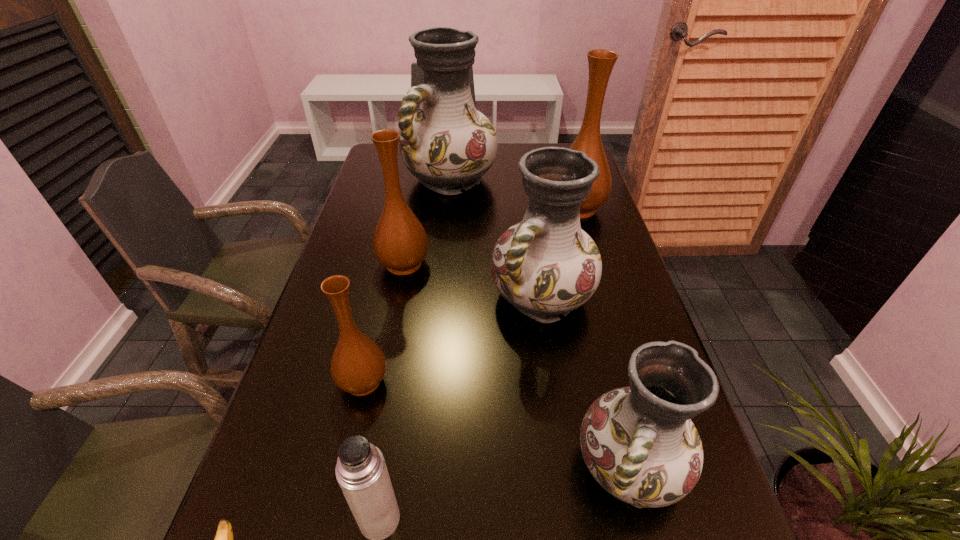
The width and height of the screenshot is (960, 540). I want to click on the farthest red vase, so click(x=447, y=144).

In order to click on the rightmost brown vase in this screenshot , I will do `click(600, 62)`.

Image resolution: width=960 pixels, height=540 pixels. Find the location of `the farthest brown vase`. the farthest brown vase is located at coordinates (600, 62).

The image size is (960, 540). Identify the location of the second farthest red vase. (546, 265).

Locate an element on the screen. the second nearest brown vase is located at coordinates (400, 242).

Identify the location of the nearest brown vase. (358, 365).

I want to click on the fourth nearest object, so click(358, 365).

Find the location of a particular element. Image resolution: width=960 pixels, height=540 pixels. the nearest red vase is located at coordinates (639, 443).

The width and height of the screenshot is (960, 540). What are the coordinates of `the nearest vase` in the screenshot? It's located at (639, 443).

Identify the location of free space located 0.060m on the right of the farthest red vase. This screenshot has height=540, width=960. (515, 179).